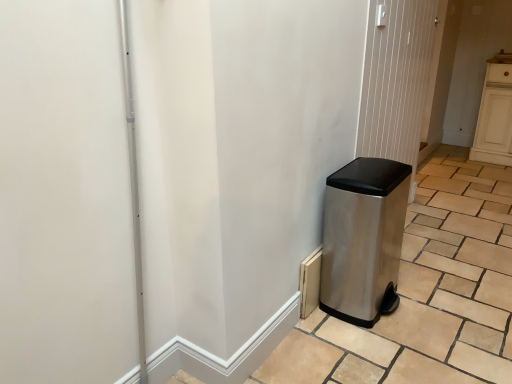
Find the location of a particular element. This screenshot has width=512, height=384. vacant area that lies to the right of stainless steel trash can at right is located at coordinates (436, 301).